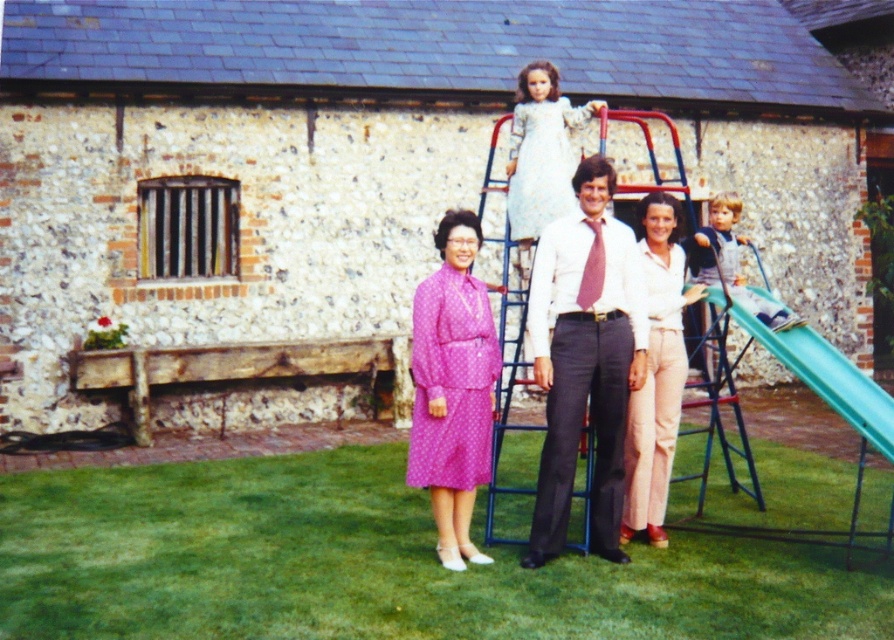
You are a parent trying to decide which toy to give to your child. The green plastic slide at right and the light brown denim overalls at right are both in the scene. Based on their sizes, which one would you choose if you want something larger for your child to play with?

The green plastic slide at right is bigger than the light brown denim overalls at right, so you should choose the green plastic slide at right for your child if you want something larger.